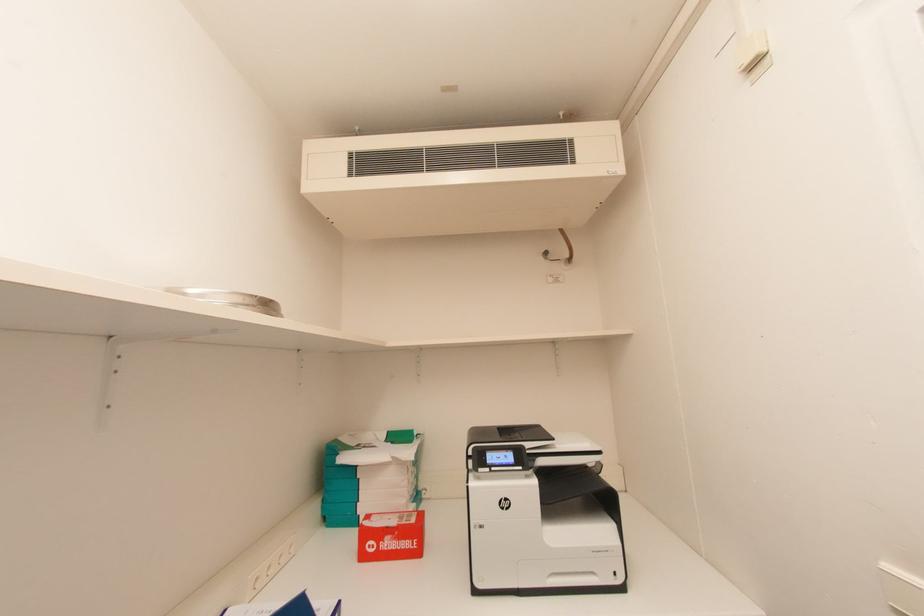
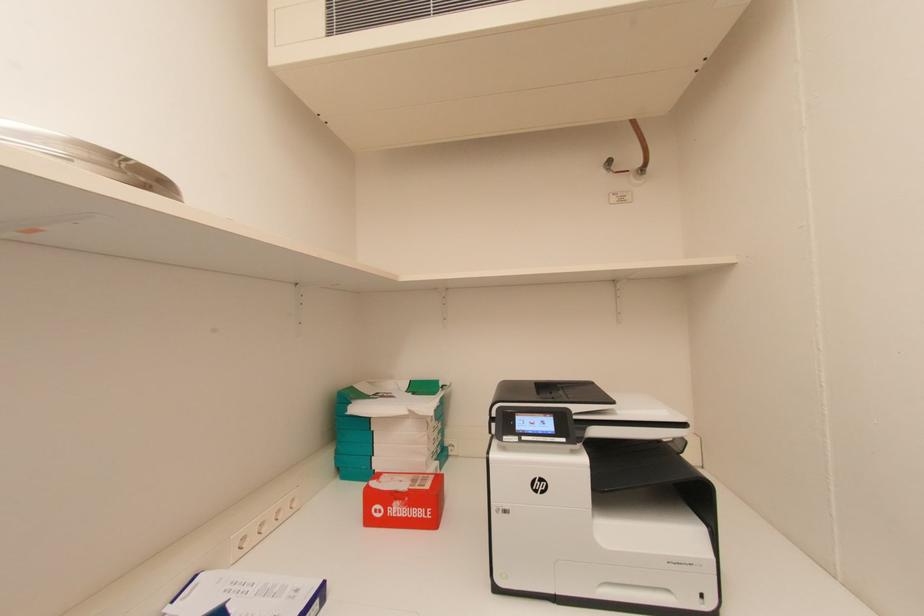
Question: The camera is either moving clockwise (left) or counter-clockwise (right) around the object. The first image is from the beginning of the video and the second image is from the end. Is the camera moving left or right when shooting the video?

Choices:
 (A) Left
 (B) Right

Answer: (B)